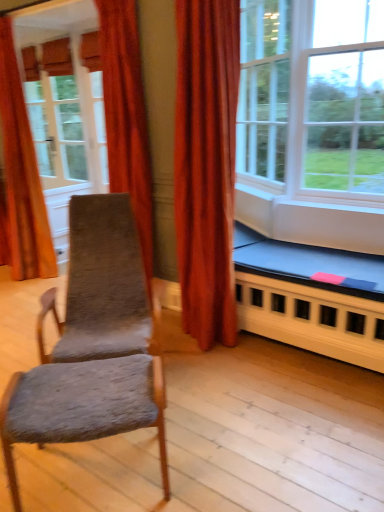
Question: Is matte white screen door at upper left turned away from velvet orange curtain at left, the first curtain in the back-to-front sequence?

Choices:
 (A) yes
 (B) no

Answer: (B)

Question: Could you tell me if matte white screen door at upper left is turned towards velvet orange curtain at left, positioned as the 1th curtain in left-to-right order?

Choices:
 (A) yes
 (B) no

Answer: (B)

Question: Does matte white screen door at upper left come behind velvet orange curtain at left, which appears as the 2th curtain when viewed from the right?

Choices:
 (A) no
 (B) yes

Answer: (B)

Question: From the image's perspective, does matte white screen door at upper left appear lower than velvet orange curtain at left, which appears as the second curtain when viewed from the front?

Choices:
 (A) no
 (B) yes

Answer: (A)

Question: Is matte white screen door at upper left thinner than velvet orange curtain at left, the first curtain in the back-to-front sequence?

Choices:
 (A) yes
 (B) no

Answer: (A)

Question: Is matte white screen door at upper left to the right of velvet orange curtain at left, positioned as the 1th curtain in left-to-right order, from the viewer's perspective?

Choices:
 (A) no
 (B) yes

Answer: (B)

Question: Is textured gray fabric chair at center not within clear glass window at center, positioned as the 2th window in left-to-right order?

Choices:
 (A) no
 (B) yes

Answer: (B)

Question: Is textured gray fabric chair at center closer to camera compared to clear glass window at center, positioned as the 2th window in left-to-right order?

Choices:
 (A) yes
 (B) no

Answer: (A)

Question: Is textured gray fabric chair at center next to clear glass window at center, positioned as the 2th window in left-to-right order?

Choices:
 (A) no
 (B) yes

Answer: (A)

Question: Does textured gray fabric chair at center have a lesser width compared to clear glass window at center, positioned as the 2th window in left-to-right order?

Choices:
 (A) yes
 (B) no

Answer: (A)

Question: Is textured gray fabric chair at center wider than clear glass window at center, marked as the 1th window in a right-to-left arrangement?

Choices:
 (A) no
 (B) yes

Answer: (A)

Question: From a real-world perspective, is textured gray fabric chair at center on top of clear glass window at center, marked as the 1th window in a right-to-left arrangement?

Choices:
 (A) yes
 (B) no

Answer: (B)

Question: Are white glass window at upper right, placed as the second window when sorted from right to left, and velvet orange curtain at upper left, which is the second curtain from left to right, beside each other?

Choices:
 (A) no
 (B) yes

Answer: (A)